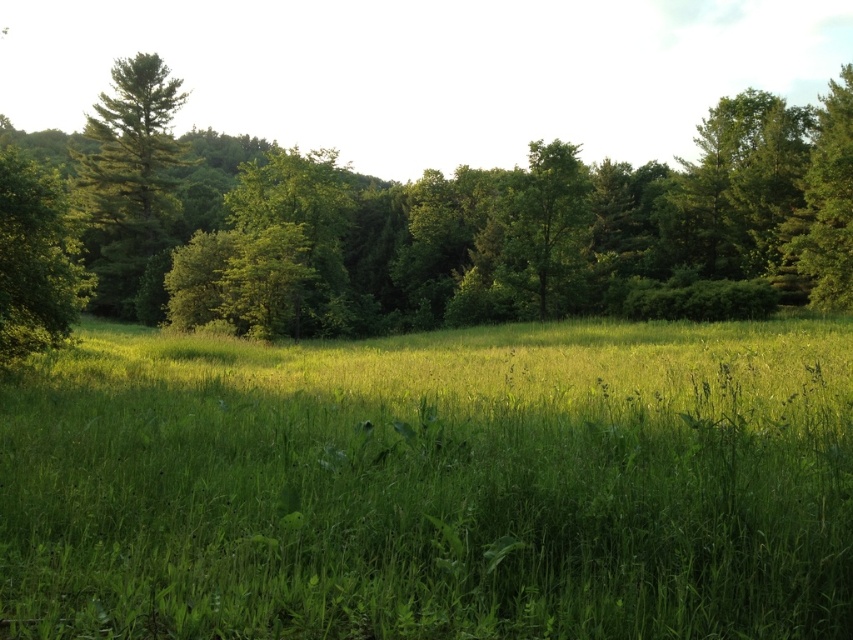
Between green grassy pasture at center and green matte tree at upper right, which one is positioned higher?

Positioned higher is green matte tree at upper right.

The image size is (853, 640). What do you see at coordinates (432, 483) in the screenshot?
I see `green grassy pasture at center` at bounding box center [432, 483].

At what (x,y) coordinates should I click in order to perform the action: click on green grassy pasture at center. Please return your answer as a coordinate pair (x, y). Image resolution: width=853 pixels, height=640 pixels. Looking at the image, I should click on (432, 483).

Based on the photo, between green leafy forest at center and green leafy tree at left, which one is positioned lower?

green leafy tree at left is below.

Can you confirm if green leafy forest at center is smaller than green leafy tree at left?

No.

Locate an element on the screen. This screenshot has width=853, height=640. green leafy forest at center is located at coordinates (427, 230).

Between green matte tree at left and green matte tree at upper right, which one has more height?

green matte tree at left

From the picture: Can you confirm if green matte tree at left is smaller than green matte tree at upper right?

No.

Is point (106, 182) closer to camera compared to point (840, 150)?

No, it is behind (840, 150).

Identify the location of green matte tree at left. (131, 176).